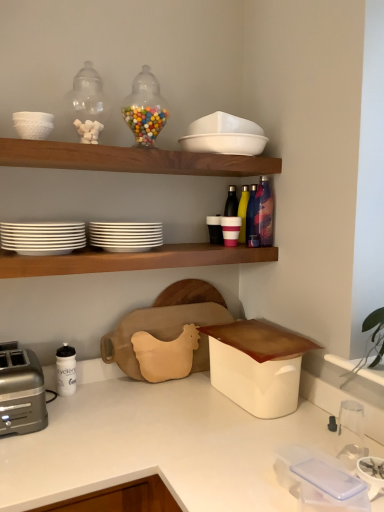
Question: Should I look upward or downward to see silver metallic toaster at lower left?

Choices:
 (A) up
 (B) down

Answer: (B)

Question: Considering the relative positions of matte black cup at center, the third tableware positioned from the top, and metallic multi-colored bottle at upper right, arranged as the third bottle when viewed from the back, in the image provided, is matte black cup at center, the third tableware positioned from the top, to the left of metallic multi-colored bottle at upper right, arranged as the third bottle when viewed from the back, from the viewer's perspective?

Choices:
 (A) no
 (B) yes

Answer: (B)

Question: Is matte black cup at center, the 5th tableware in the bottom-to-top sequence, far away from metallic multi-colored bottle at upper right, arranged as the third bottle when viewed from the back?

Choices:
 (A) yes
 (B) no

Answer: (B)

Question: Can you confirm if matte black cup at center, the 5th tableware in the bottom-to-top sequence, is taller than metallic multi-colored bottle at upper right, arranged as the third bottle when viewed from the back?

Choices:
 (A) yes
 (B) no

Answer: (B)

Question: Considering the relative sizes of matte black cup at center, the third tableware positioned from the top, and metallic multi-colored bottle at upper right, arranged as the third bottle when viewed from the back, in the image provided, is matte black cup at center, the third tableware positioned from the top, bigger than metallic multi-colored bottle at upper right, arranged as the third bottle when viewed from the back,?

Choices:
 (A) yes
 (B) no

Answer: (B)

Question: Could you tell me if matte black cup at center, the 5th tableware in the bottom-to-top sequence, is facing metallic multi-colored bottle at upper right, arranged as the third bottle when viewed from the back?

Choices:
 (A) no
 (B) yes

Answer: (A)

Question: Does matte black cup at center, the third tableware positioned from the top, lie in front of metallic multi-colored bottle at upper right, arranged as the third bottle when viewed from the back?

Choices:
 (A) no
 (B) yes

Answer: (A)

Question: Would you say metallic blue water bottle at upper right, the second bottle in the front-to-back sequence, is a long distance from white matte bowl at upper left, placed as the 6th tableware when sorted from bottom to top?

Choices:
 (A) no
 (B) yes

Answer: (A)

Question: From the image's perspective, does metallic blue water bottle at upper right, the 2th bottle when ordered from back to front, appear lower than white matte bowl at upper left, placed as the 6th tableware when sorted from bottom to top?

Choices:
 (A) no
 (B) yes

Answer: (B)

Question: Does metallic blue water bottle at upper right, the second bottle in the front-to-back sequence, have a smaller size compared to white matte bowl at upper left, placed as the 6th tableware when sorted from bottom to top?

Choices:
 (A) no
 (B) yes

Answer: (B)

Question: Considering the relative sizes of metallic blue water bottle at upper right, the 2th bottle when ordered from back to front, and white matte bowl at upper left, placed as the 6th tableware when sorted from bottom to top, in the image provided, is metallic blue water bottle at upper right, the 2th bottle when ordered from back to front, wider than white matte bowl at upper left, placed as the 6th tableware when sorted from bottom to top,?

Choices:
 (A) no
 (B) yes

Answer: (A)

Question: Considering the relative sizes of metallic blue water bottle at upper right, the second bottle in the front-to-back sequence, and white matte bowl at upper left, placed as the 6th tableware when sorted from bottom to top, in the image provided, is metallic blue water bottle at upper right, the second bottle in the front-to-back sequence, taller than white matte bowl at upper left, placed as the 6th tableware when sorted from bottom to top,?

Choices:
 (A) no
 (B) yes

Answer: (B)

Question: Does metallic blue water bottle at upper right, the second bottle in the front-to-back sequence, lie in front of white matte bowl at upper left, the 2th tableware positioned from the top?

Choices:
 (A) yes
 (B) no

Answer: (B)

Question: Is metallic multi-colored bottle at upper right, the 1th bottle viewed from the front, positioned in front of silver metallic toaster at lower left?

Choices:
 (A) no
 (B) yes

Answer: (A)